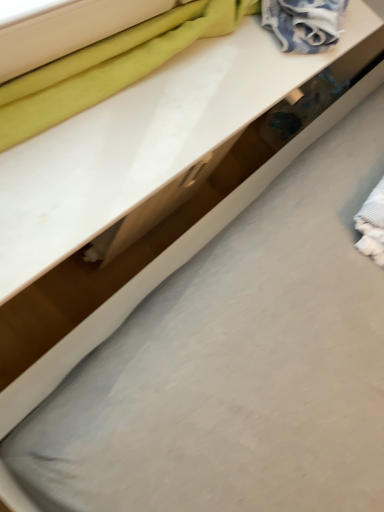
At what (x,y) coordinates should I click in order to perform the action: click on free spot to the right of matte yellow fabric at upper left. Please return your answer as a coordinate pair (x, y). Looking at the image, I should click on (195, 103).